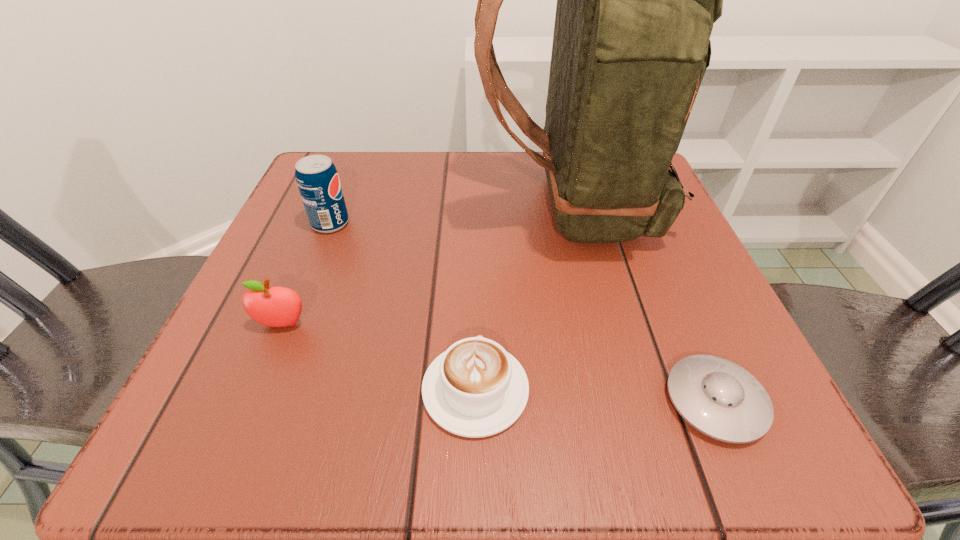
At what (x,y) coordinates should I click in order to perform the action: click on free space located on the back of the third farthest object. Please return your answer as a coordinate pair (x, y). Image resolution: width=960 pixels, height=540 pixels. Looking at the image, I should click on (344, 178).

What are the coordinates of `vacant region located with the handle on the right side of the cappuccino` in the screenshot? It's located at (477, 246).

The height and width of the screenshot is (540, 960). Identify the location of free space located with the handle on the right side of the cappuccino. (476, 265).

At what (x,y) coordinates should I click in order to perform the action: click on blank space located with the handle on the right side of the cappuccino. Please return your answer as a coordinate pair (x, y). Image resolution: width=960 pixels, height=540 pixels. Looking at the image, I should click on (476, 254).

This screenshot has height=540, width=960. I want to click on free region located on the back of the saucer, so point(682,322).

Locate an element on the screen. backpack that is at the far edge is located at coordinates (636, 0).

Where is `pop that is at the far edge`? This screenshot has height=540, width=960. pop that is at the far edge is located at coordinates (317, 179).

Find the location of a particular element. The height and width of the screenshot is (540, 960). cappuccino that is positioned at the near edge is located at coordinates (474, 389).

This screenshot has width=960, height=540. Identify the location of saucer at the near edge. (719, 398).

Locate an element on the screen. pop present at the left edge is located at coordinates (317, 179).